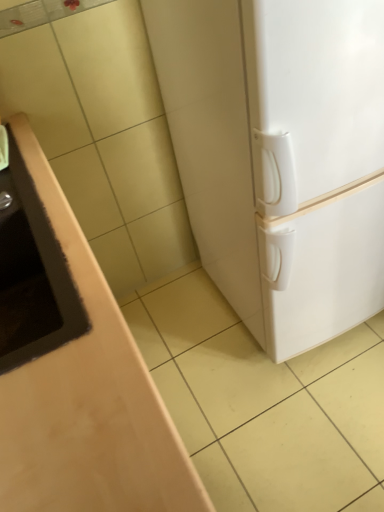
This screenshot has height=512, width=384. What do you see at coordinates (280, 156) in the screenshot?
I see `white matte refrigerator at right` at bounding box center [280, 156].

This screenshot has height=512, width=384. What are the coordinates of `white matte refrigerator at right` in the screenshot? It's located at (280, 156).

Measure the distance between point (x=283, y=44) and camera.

They are 27.91 inches apart.

What are the coordinates of `matte brown sink at left` in the screenshot? It's located at (32, 273).

This screenshot has width=384, height=512. What do you see at coordinates (32, 273) in the screenshot?
I see `matte brown sink at left` at bounding box center [32, 273].

Identify the location of white matte refrigerator at right. (280, 156).

Is matte brown sink at left to the left of white matte refrigerator at right from the viewer's perspective?

Indeed, matte brown sink at left is positioned on the left side of white matte refrigerator at right.

Considering their positions, is matte brown sink at left located in front of or behind white matte refrigerator at right?

Visually, matte brown sink at left is located in front of white matte refrigerator at right.

Does point (15, 253) appear closer or farther from the camera than point (312, 96)?

Clearly, point (15, 253) is more distant from the camera than point (312, 96).

From the image's perspective, is matte brown sink at left under white matte refrigerator at right?

Yes, from the image's perspective, matte brown sink at left is beneath white matte refrigerator at right.

From a real-world perspective, which object rests below the other?

white matte refrigerator at right is physically lower.

From the picture: Which object is thinner, matte brown sink at left or white matte refrigerator at right?

With smaller width is matte brown sink at left.

Does matte brown sink at left have a lesser height compared to white matte refrigerator at right?

Indeed, matte brown sink at left has a lesser height compared to white matte refrigerator at right.

Is matte brown sink at left bigger than white matte refrigerator at right?

Actually, matte brown sink at left might be smaller than white matte refrigerator at right.

Choose the correct answer: Is matte brown sink at left inside white matte refrigerator at right or outside it?

matte brown sink at left exists outside the volume of white matte refrigerator at right.

Is matte brown sink at left beside white matte refrigerator at right?

No, matte brown sink at left is not touching white matte refrigerator at right.

Is matte brown sink at left facing towards white matte refrigerator at right?

Yes, matte brown sink at left is turned towards white matte refrigerator at right.

Where is `sink above the white matte refrigerator at right (from a real-world perspective)`? This screenshot has width=384, height=512. sink above the white matte refrigerator at right (from a real-world perspective) is located at coordinates (32, 273).

Consider the image. Is white matte refrigerator at right to the left or to the right of matte brown sink at left in the image?

From the image, it's evident that white matte refrigerator at right is to the right of matte brown sink at left.

Which object is further away from the camera, white matte refrigerator at right or matte brown sink at left?

white matte refrigerator at right is further from the camera.

Which is more distant, (373, 242) or (80, 333)?

The point (373, 242) is farther from the camera.

From the image's perspective, which object appears higher, white matte refrigerator at right or matte brown sink at left?

white matte refrigerator at right, from the image's perspective.

From a real-world perspective, is white matte refrigerator at right under matte brown sink at left?

Correct, in the physical world, white matte refrigerator at right is lower than matte brown sink at left.

In terms of width, does white matte refrigerator at right look wider or thinner when compared to matte brown sink at left?

In the image, white matte refrigerator at right appears to be wider than matte brown sink at left.

Can you confirm if white matte refrigerator at right is taller than matte brown sink at left?

Yes, white matte refrigerator at right is taller than matte brown sink at left.

In the scene shown: In terms of size, does white matte refrigerator at right appear bigger or smaller than matte brown sink at left?

Considering their sizes, white matte refrigerator at right takes up more space than matte brown sink at left.

Would you say white matte refrigerator at right is outside matte brown sink at left?

Yes.

Is white matte refrigerator at right touching matte brown sink at left?

white matte refrigerator at right is not next to matte brown sink at left, and they're not touching.

Is white matte refrigerator at right looking in the opposite direction of matte brown sink at left?

white matte refrigerator at right does not have its back to matte brown sink at left.

What's the angular difference between white matte refrigerator at right and matte brown sink at left's facing directions?

There is a 92.1-degree angle between the facing directions of white matte refrigerator at right and matte brown sink at left.

Locate an element on the screen. Image resolution: width=384 pixels, height=512 pixels. refrigerator above the matte brown sink at left (from the image's perspective) is located at coordinates (280, 156).

You are a GUI agent. You are given a task and a screenshot of the screen. Output one action in this format:
    pyautogui.click(x=<x>, y=<y>)
    Task: Click on the refrigerator that appears behind the matte brown sink at left
    
    Given the screenshot: What is the action you would take?
    pyautogui.click(x=280, y=156)

Where is `sink below the white matte refrigerator at right (from the image's perspective)`? sink below the white matte refrigerator at right (from the image's perspective) is located at coordinates (32, 273).